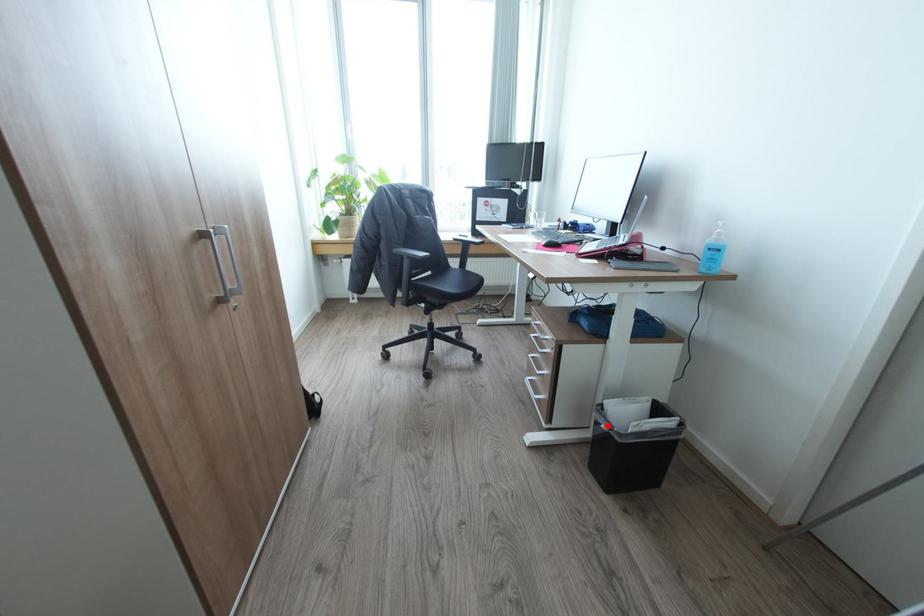
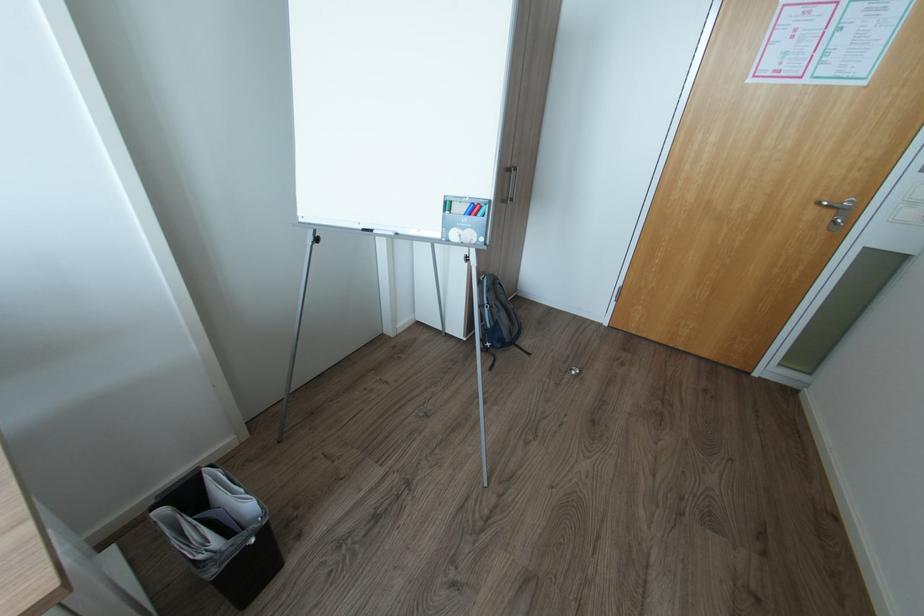
Question: I am providing you with two images of the same scene from different viewpoints. A red point is marked on the first image. Is the red point's position out of view in image 2?

Choices:
 (A) Yes
 (B) No

Answer: (B)